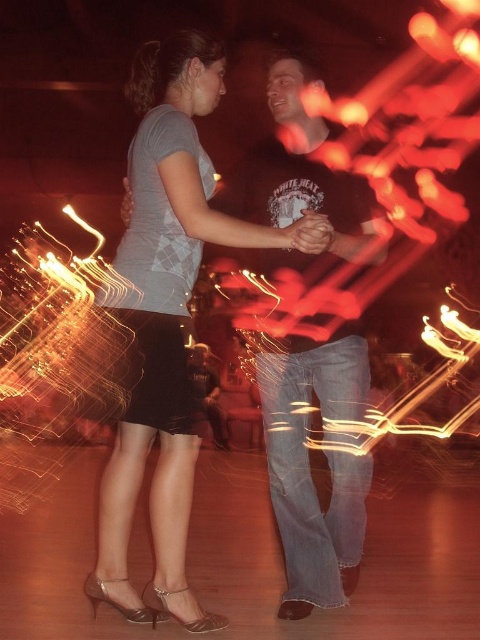
You are a photographer trying to capture the dancers in the image. You want to ensure that both the matte gray shirt at center and the dark brown leather pants at center are clearly visible in your photo. Given their widths, which clothing item would require more space horizontally in the frame?

The matte gray shirt at center is wider than the dark brown leather pants at center, so it would require more horizontal space in the frame to ensure clarity.

Consider the image. Based on the scene description, where is the matte gray shirt at center located in terms of its 2D coordinates?

The matte gray shirt at center is located at the 2D coordinates point [167,317].